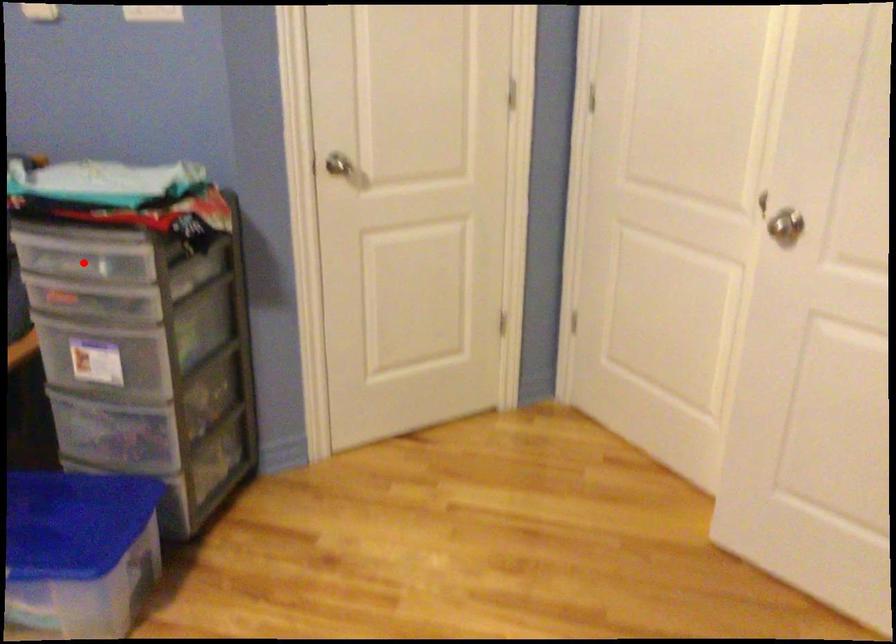
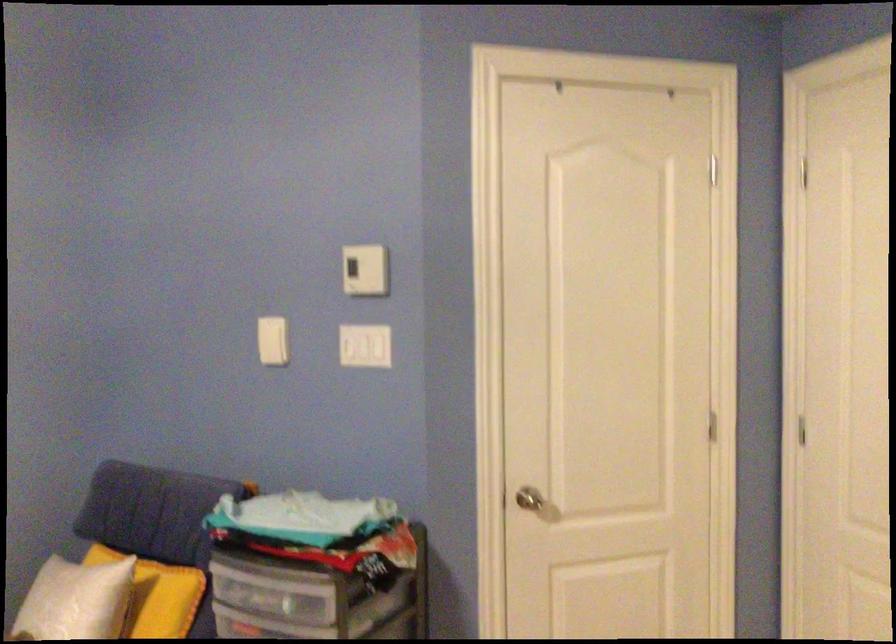
Where in the second image is the point corresponding to the highlighted location from the first image?

(270, 592)